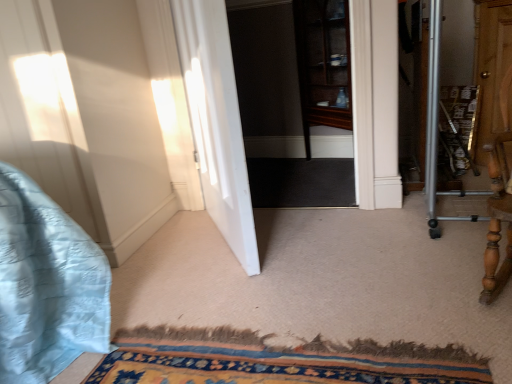
Question: Can you confirm if white smooth door at center is shorter than transparent glass cabinet at center?

Choices:
 (A) no
 (B) yes

Answer: (A)

Question: From the image's perspective, is white smooth door at center under transparent glass cabinet at center?

Choices:
 (A) no
 (B) yes

Answer: (B)

Question: Is white smooth door at center not near transparent glass cabinet at center?

Choices:
 (A) no
 (B) yes

Answer: (A)

Question: From a real-world perspective, is white smooth door at center over transparent glass cabinet at center?

Choices:
 (A) no
 (B) yes

Answer: (B)

Question: Can you confirm if white smooth door at center is thinner than transparent glass cabinet at center?

Choices:
 (A) yes
 (B) no

Answer: (B)

Question: Do you think transparent glass cabinet at center is within carpeted mat at lower center, or outside of it?

Choices:
 (A) outside
 (B) inside

Answer: (A)

Question: Considering the relative positions of transparent glass cabinet at center and carpeted mat at lower center in the image provided, is transparent glass cabinet at center to the left or to the right of carpeted mat at lower center?

Choices:
 (A) right
 (B) left

Answer: (A)

Question: In terms of width, does transparent glass cabinet at center look wider or thinner when compared to carpeted mat at lower center?

Choices:
 (A) wide
 (B) thin

Answer: (B)

Question: From a real-world perspective, is transparent glass cabinet at center positioned above or below carpeted mat at lower center?

Choices:
 (A) below
 (B) above

Answer: (B)

Question: Looking at their shapes, would you say transparent glass cabinet at center is wider or thinner than white smooth door at center?

Choices:
 (A) wide
 (B) thin

Answer: (B)

Question: Considering the positions of transparent glass cabinet at center and white smooth door at center in the image, is transparent glass cabinet at center bigger or smaller than white smooth door at center?

Choices:
 (A) small
 (B) big

Answer: (A)

Question: Relative to white smooth door at center, is transparent glass cabinet at center in front or behind?

Choices:
 (A) front
 (B) behind

Answer: (B)

Question: Is transparent glass cabinet at center inside the boundaries of white smooth door at center, or outside?

Choices:
 (A) outside
 (B) inside

Answer: (A)

Question: In terms of width, does carpeted mat at lower center look wider or thinner when compared to transparent glass cabinet at center?

Choices:
 (A) wide
 (B) thin

Answer: (A)

Question: From a real-world perspective, is carpeted mat at lower center above or below transparent glass cabinet at center?

Choices:
 (A) above
 (B) below

Answer: (B)